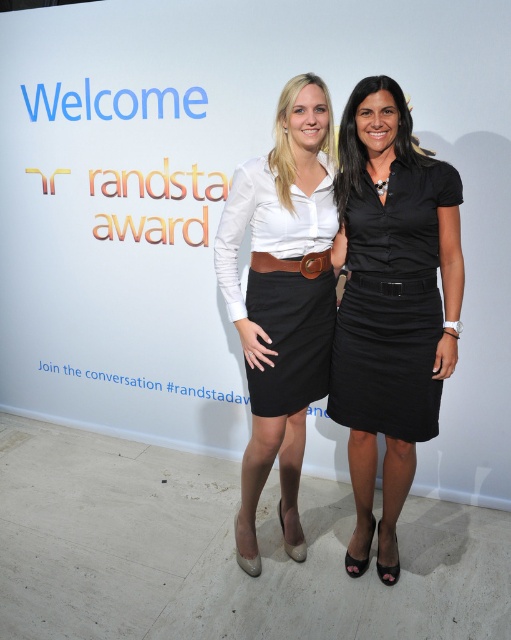
Who is lower down, matte white blouse at center or black satin skirt at right?

matte white blouse at center is lower down.

Does matte white blouse at center have a larger size compared to black satin skirt at right?

Yes, matte white blouse at center is bigger than black satin skirt at right.

Consider the image. Who is more forward, (314, 220) or (339, 422)?

Point (314, 220)

This screenshot has height=640, width=511. Find the location of `matte white blouse at center`. matte white blouse at center is located at coordinates (282, 300).

Can you confirm if matte white blouse at center is positioned above black leather belt at center?

No, matte white blouse at center is not above black leather belt at center.

What do you see at coordinates (282, 300) in the screenshot? The image size is (511, 640). I see `matte white blouse at center` at bounding box center [282, 300].

The width and height of the screenshot is (511, 640). Identify the location of matte white blouse at center. (282, 300).

Identify the location of matte white blouse at center. The image size is (511, 640). (282, 300).

Which is more to the right, black satin skirt at right or brown leather belt at center?

Positioned to the right is black satin skirt at right.

Does black satin skirt at right have a lesser width compared to brown leather belt at center?

Incorrect, black satin skirt at right's width is not less than brown leather belt at center's.

Who is more forward, (410, 292) or (261, 252)?

Point (410, 292) is in front.

The image size is (511, 640). I want to click on black satin skirt at right, so click(x=391, y=305).